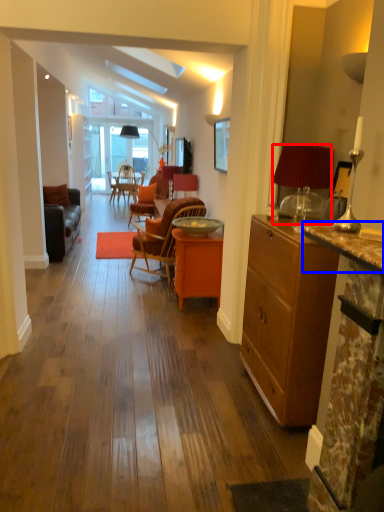
Question: Among these objects, which one is farthest to the camera, lamp (highlighted by a red box) or counter top (highlighted by a blue box)?

Choices:
 (A) lamp
 (B) counter top

Answer: (A)